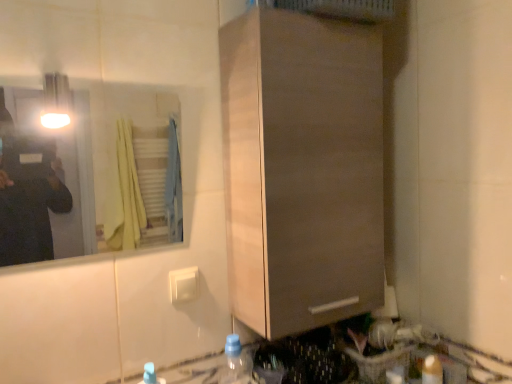
Question: Is translucent plastic bottle at lower center, placed as the second bottle when sorted from left to right, in front of or behind blue translucent bottle at lower center, which is counted as the 3th bottle, starting from the right, in the image?

Choices:
 (A) behind
 (B) front

Answer: (A)

Question: From a real-world perspective, is translucent plastic bottle at lower center, the 2th bottle from the right, physically located above or below blue translucent bottle at lower center, marked as the 1th bottle in a left-to-right arrangement?

Choices:
 (A) above
 (B) below

Answer: (B)

Question: Considering the real-world distances, which object is farthest from the clear glass mirror at upper left?

Choices:
 (A) blue translucent bottle at lower center, which is counted as the 3th bottle, starting from the right
 (B) translucent plastic bottle at lower right, which is the 3th bottle from left to right
 (C) translucent plastic bottle at lower center, placed as the second bottle when sorted from left to right
 (D) matte wood cabinet at center

Answer: (B)

Question: Which is farther from the clear glass mirror at upper left?

Choices:
 (A) blue translucent bottle at lower center, which is counted as the 3th bottle, starting from the right
 (B) translucent plastic bottle at lower right, which is the 3th bottle from left to right
 (C) translucent plastic bottle at lower center, placed as the second bottle when sorted from left to right
 (D) matte wood cabinet at center

Answer: (B)